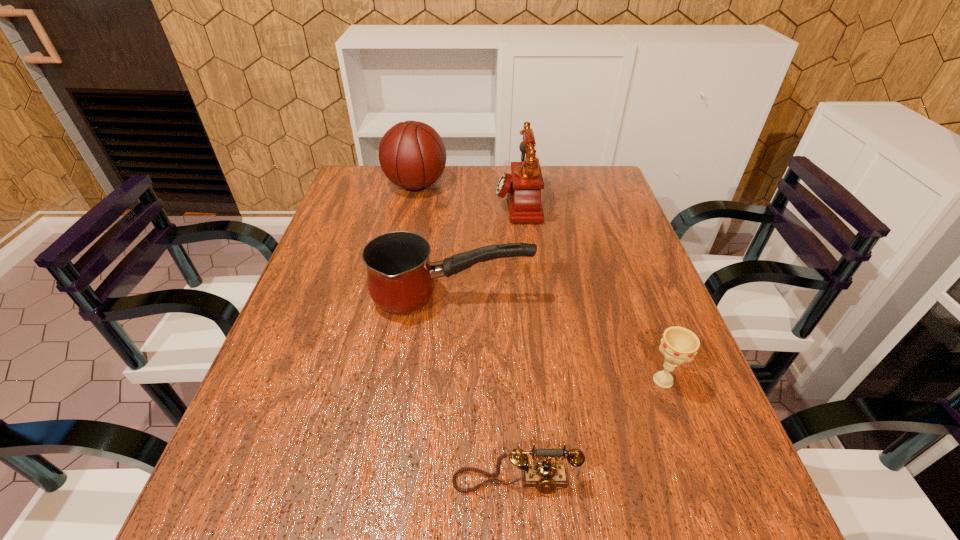
What are the coordinates of `vacant area that lies between the basketball and the chalice` in the screenshot? It's located at (540, 282).

I want to click on vacant space that is in between the chalice and the shorter telephone, so click(589, 431).

Where is `vacant space that is in between the fourth tallest object and the taller telephone`? vacant space that is in between the fourth tallest object and the taller telephone is located at coordinates (590, 291).

This screenshot has width=960, height=540. What are the coordinates of `vacant space in between the nearest object and the third nearest object` in the screenshot? It's located at (484, 390).

The image size is (960, 540). What are the coordinates of `free space that is in between the chalice and the nearer telephone` in the screenshot? It's located at (589, 431).

The height and width of the screenshot is (540, 960). What are the coordinates of `object that is the second closest to the farther telephone` in the screenshot? It's located at (400, 276).

Where is `object that is the fourth closest one to the chalice`? The width and height of the screenshot is (960, 540). object that is the fourth closest one to the chalice is located at coordinates (412, 155).

The height and width of the screenshot is (540, 960). I want to click on free space that satisfies the following two spatial constraints: 1. on the dial of the taller telephone; 2. on the back side of the fourth farthest object, so click(x=539, y=380).

Where is `free spot that satisfies the following two spatial constraints: 1. on the front side of the second nearest object; 2. on the left side of the basketball`? free spot that satisfies the following two spatial constraints: 1. on the front side of the second nearest object; 2. on the left side of the basketball is located at coordinates click(x=375, y=380).

The width and height of the screenshot is (960, 540). In order to click on vacant space that satisfies the following two spatial constraints: 1. on the handle side of the third shortest object; 2. on the right side of the second shortest object in this screenshot , I will do `click(446, 380)`.